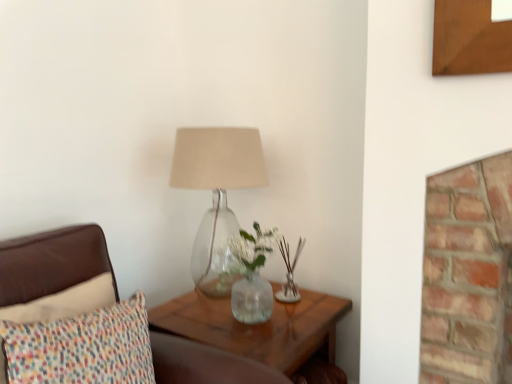
Question: Is multicolored fabric pillow at left taller than translucent glass lamp at center?

Choices:
 (A) no
 (B) yes

Answer: (A)

Question: Would you say translucent glass lamp at center is part of multicolored fabric pillow at left's contents?

Choices:
 (A) yes
 (B) no

Answer: (B)

Question: Can you confirm if multicolored fabric pillow at left is positioned to the left of translucent glass lamp at center?

Choices:
 (A) yes
 (B) no

Answer: (A)

Question: From the image's perspective, is multicolored fabric pillow at left on top of translucent glass lamp at center?

Choices:
 (A) no
 (B) yes

Answer: (A)

Question: Considering the relative positions of multicolored fabric pillow at left and translucent glass lamp at center in the image provided, is multicolored fabric pillow at left behind translucent glass lamp at center?

Choices:
 (A) no
 (B) yes

Answer: (A)

Question: Do you think multicolored fabric pillow at left is within translucent glass lamp at center, or outside of it?

Choices:
 (A) inside
 (B) outside

Answer: (B)

Question: Is multicolored fabric pillow at left wider or thinner than translucent glass lamp at center?

Choices:
 (A) wide
 (B) thin

Answer: (B)

Question: In the image, is multicolored fabric pillow at left on the left side or the right side of translucent glass lamp at center?

Choices:
 (A) right
 (B) left

Answer: (B)

Question: Considering the positions of multicolored fabric pillow at left and translucent glass lamp at center in the image, is multicolored fabric pillow at left taller or shorter than translucent glass lamp at center?

Choices:
 (A) tall
 (B) short

Answer: (B)

Question: Considering the positions of translucent wood table at lower right and multicolored fabric pillow at left in the image, is translucent wood table at lower right bigger or smaller than multicolored fabric pillow at left?

Choices:
 (A) big
 (B) small

Answer: (A)

Question: From the image's perspective, relative to multicolored fabric pillow at left, is translucent wood table at lower right above or below?

Choices:
 (A) above
 (B) below

Answer: (B)

Question: Is point (239, 331) closer or farther from the camera than point (196, 352)?

Choices:
 (A) farther
 (B) closer

Answer: (A)

Question: Considering the positions of translucent wood table at lower right and multicolored fabric pillow at left in the image, is translucent wood table at lower right taller or shorter than multicolored fabric pillow at left?

Choices:
 (A) short
 (B) tall

Answer: (B)

Question: In terms of height, does translucent glass lamp at center look taller or shorter compared to translucent wood table at lower right?

Choices:
 (A) tall
 (B) short

Answer: (A)

Question: Considering their positions, is translucent glass lamp at center located in front of or behind translucent wood table at lower right?

Choices:
 (A) behind
 (B) front

Answer: (A)